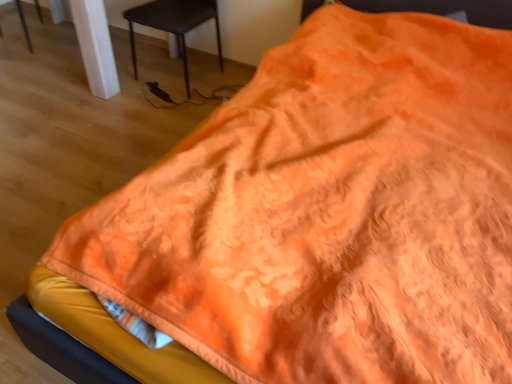
Question: Which is correct: matte white chair at upper left, the 1th chair viewed from the left, is inside black plastic chair at lower left, the 1th chair positioned from the right, or outside of it?

Choices:
 (A) inside
 (B) outside

Answer: (B)

Question: Based on their positions, is matte white chair at upper left, the 1th chair viewed from the left, located to the left or right of black plastic chair at lower left, the 2th chair viewed from the left?

Choices:
 (A) left
 (B) right

Answer: (A)

Question: Relative to black plastic chair at lower left, the 2th chair viewed from the left, is matte white chair at upper left, which is counted as the 2th chair, starting from the right, in front or behind?

Choices:
 (A) front
 (B) behind

Answer: (B)

Question: Considering the positions of black plastic chair at lower left, the 1th chair positioned from the right, and matte white chair at upper left, the 1th chair viewed from the left, in the image, is black plastic chair at lower left, the 1th chair positioned from the right, taller or shorter than matte white chair at upper left, the 1th chair viewed from the left,?

Choices:
 (A) tall
 (B) short

Answer: (A)

Question: From a real-world perspective, is black plastic chair at lower left, the 1th chair positioned from the right, positioned above or below matte white chair at upper left, which is counted as the 2th chair, starting from the right?

Choices:
 (A) above
 (B) below

Answer: (A)

Question: Is black plastic chair at lower left, the 2th chair viewed from the left, to the left or to the right of matte white chair at upper left, which is counted as the 2th chair, starting from the right, in the image?

Choices:
 (A) right
 (B) left

Answer: (A)

Question: Considering the positions of black plastic chair at lower left, the 1th chair positioned from the right, and matte white chair at upper left, which is counted as the 2th chair, starting from the right, in the image, is black plastic chair at lower left, the 1th chair positioned from the right, wider or thinner than matte white chair at upper left, which is counted as the 2th chair, starting from the right,?

Choices:
 (A) wide
 (B) thin

Answer: (A)